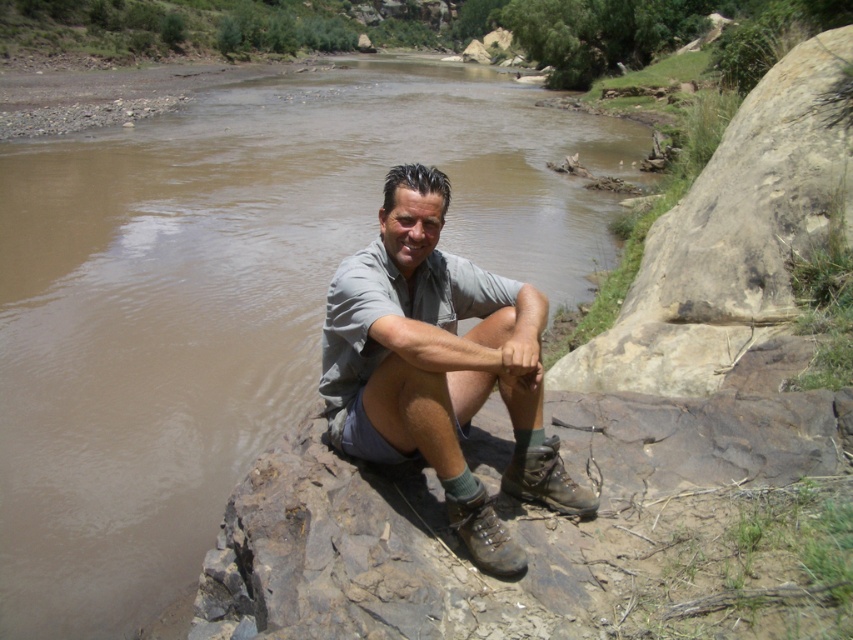
Consider the image. Does brown leather boot at lower center have a lesser width compared to muddy leather hiking boot at lower center?

Incorrect, brown leather boot at lower center's width is not less than muddy leather hiking boot at lower center's.

Can you confirm if brown leather boot at lower center is wider than muddy leather hiking boot at lower center?

Indeed, brown leather boot at lower center has a greater width compared to muddy leather hiking boot at lower center.

Find the location of a particular element. This screenshot has height=640, width=853. brown leather boot at lower center is located at coordinates (546, 480).

Is brown muddy water at center above brown leather boot at lower center?

Indeed, brown muddy water at center is positioned over brown leather boot at lower center.

Is brown muddy water at center bigger than brown leather boot at lower center?

Yes, brown muddy water at center is bigger than brown leather boot at lower center.

Which is behind, point (111, 476) or point (554, 435)?

Positioned behind is point (111, 476).

I want to click on brown muddy water at center, so click(230, 300).

Does brown muddy water at center have a larger size compared to gray fabric shirt at center?

Yes, brown muddy water at center is bigger than gray fabric shirt at center.

Does brown muddy water at center appear over gray fabric shirt at center?

Indeed, brown muddy water at center is positioned over gray fabric shirt at center.

In the scene shown: Who is more distant from viewer, (223, 172) or (387, 182)?

The point (223, 172) is behind.

I want to click on brown muddy water at center, so click(x=230, y=300).